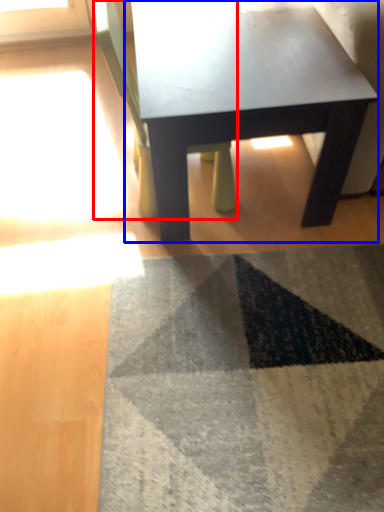
Question: Among these objects, which one is farthest to the camera, chair (highlighted by a red box) or coffee table (highlighted by a blue box)?

Choices:
 (A) chair
 (B) coffee table

Answer: (B)